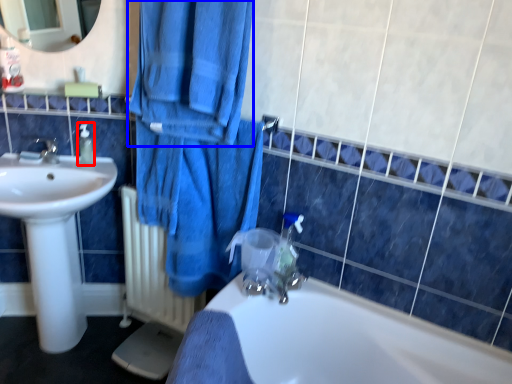
Question: Which of the following is the closest to the observer, soap dispenser (highlighted by a red box) or bath towel (highlighted by a blue box)?

Choices:
 (A) soap dispenser
 (B) bath towel

Answer: (B)